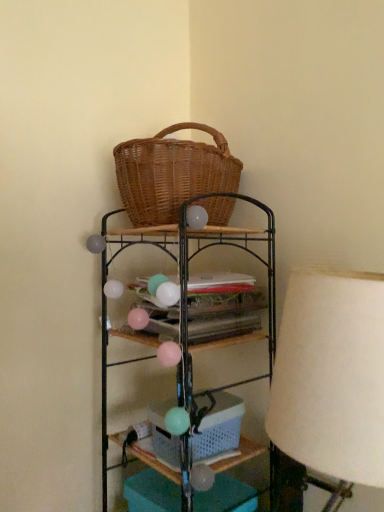
Question: Considering the relative sizes of woven wood basket at upper center and white fabric lampshade at right in the image provided, is woven wood basket at upper center smaller than white fabric lampshade at right?

Choices:
 (A) no
 (B) yes

Answer: (A)

Question: Can you confirm if woven wood basket at upper center is taller than white fabric lampshade at right?

Choices:
 (A) no
 (B) yes

Answer: (B)

Question: Is woven wood basket at upper center positioned far away from white fabric lampshade at right?

Choices:
 (A) yes
 (B) no

Answer: (B)

Question: Is woven wood basket at upper center located outside white fabric lampshade at right?

Choices:
 (A) no
 (B) yes

Answer: (B)

Question: From a real-world perspective, is woven wood basket at upper center positioned under white fabric lampshade at right based on gravity?

Choices:
 (A) yes
 (B) no

Answer: (A)

Question: From the image's perspective, is woven wood basket at upper center beneath white fabric lampshade at right?

Choices:
 (A) no
 (B) yes

Answer: (B)

Question: Does woven brown picnic basket at upper center lie behind woven wood basket at upper center?

Choices:
 (A) yes
 (B) no

Answer: (A)

Question: Is woven brown picnic basket at upper center bigger than woven wood basket at upper center?

Choices:
 (A) yes
 (B) no

Answer: (B)

Question: From the image's perspective, is woven brown picnic basket at upper center under woven wood basket at upper center?

Choices:
 (A) yes
 (B) no

Answer: (B)

Question: Is woven brown picnic basket at upper center taller than woven wood basket at upper center?

Choices:
 (A) yes
 (B) no

Answer: (B)

Question: Can you confirm if woven brown picnic basket at upper center is smaller than woven wood basket at upper center?

Choices:
 (A) yes
 (B) no

Answer: (A)

Question: Is woven brown picnic basket at upper center located outside woven wood basket at upper center?

Choices:
 (A) no
 (B) yes

Answer: (B)

Question: Does matte wicker basket at center appear on the left side of white fabric lampshade at right?

Choices:
 (A) no
 (B) yes

Answer: (B)